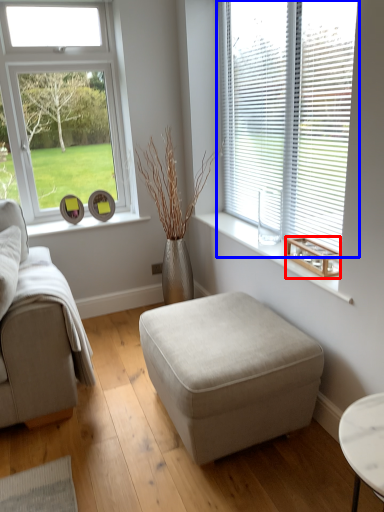
Question: Which point is further to the camera, wood (highlighted by a red box) or window (highlighted by a blue box)?

Choices:
 (A) wood
 (B) window

Answer: (A)